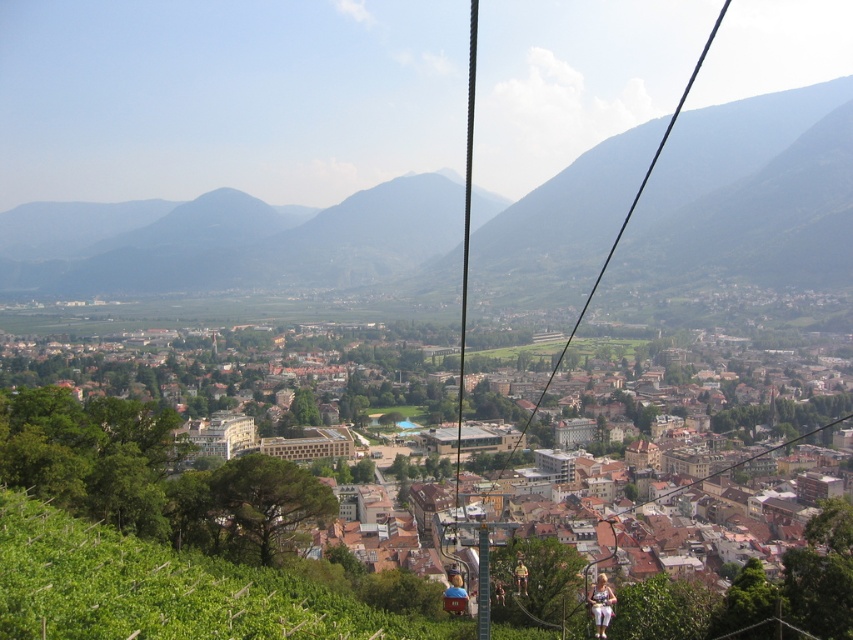
Question: Which of the following is the farthest from the observer?

Choices:
 (A) yellow fabric jacket at lower right
 (B) metallic cable car at center
 (C) white fabric pants at lower center

Answer: (A)

Question: Among these points, which one is nearest to the camera?

Choices:
 (A) (x=436, y=433)
 (B) (x=688, y=81)
 (C) (x=604, y=577)

Answer: (C)

Question: Is brown wooden buildings at center to the right of metallic cable car at center from the viewer's perspective?

Choices:
 (A) yes
 (B) no

Answer: (B)

Question: Is the position of metallic cable car at center more distant than that of yellow fabric jacket at lower right?

Choices:
 (A) no
 (B) yes

Answer: (A)

Question: Is brown wooden buildings at center further to camera compared to yellow fabric jacket at lower right?

Choices:
 (A) yes
 (B) no

Answer: (B)

Question: Which object is farther from the camera taking this photo?

Choices:
 (A) yellow fabric jacket at lower right
 (B) brown wooden buildings at center

Answer: (A)